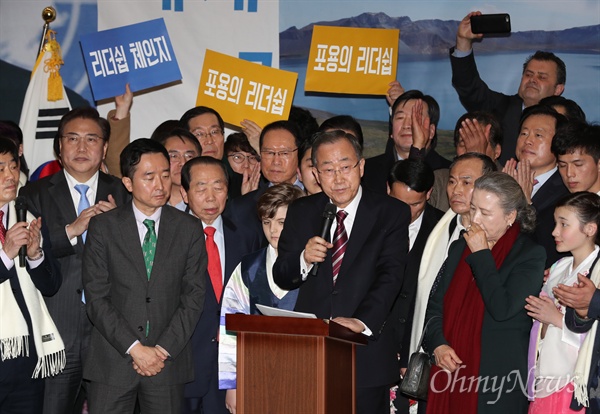
Where is `papers`? papers is located at coordinates (280, 311).